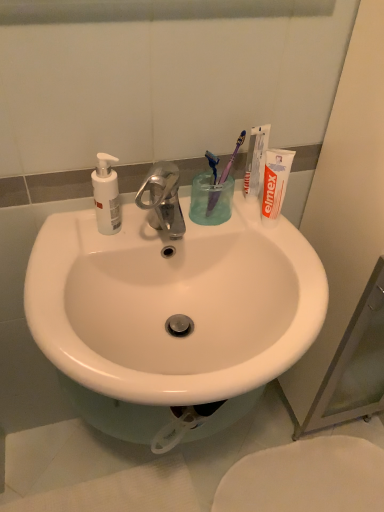
This screenshot has height=512, width=384. I want to click on free space to the right of transparent plastic cup at center, so click(268, 234).